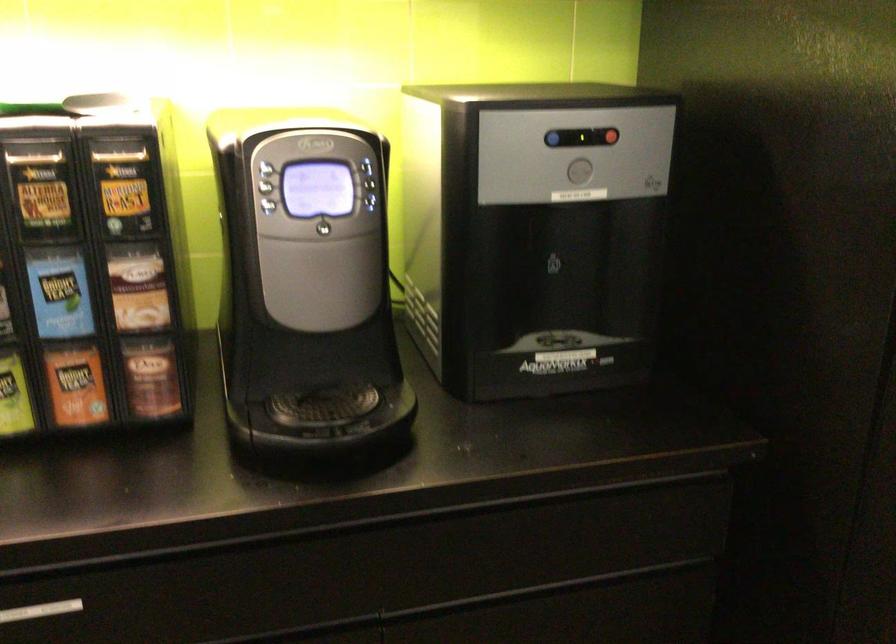
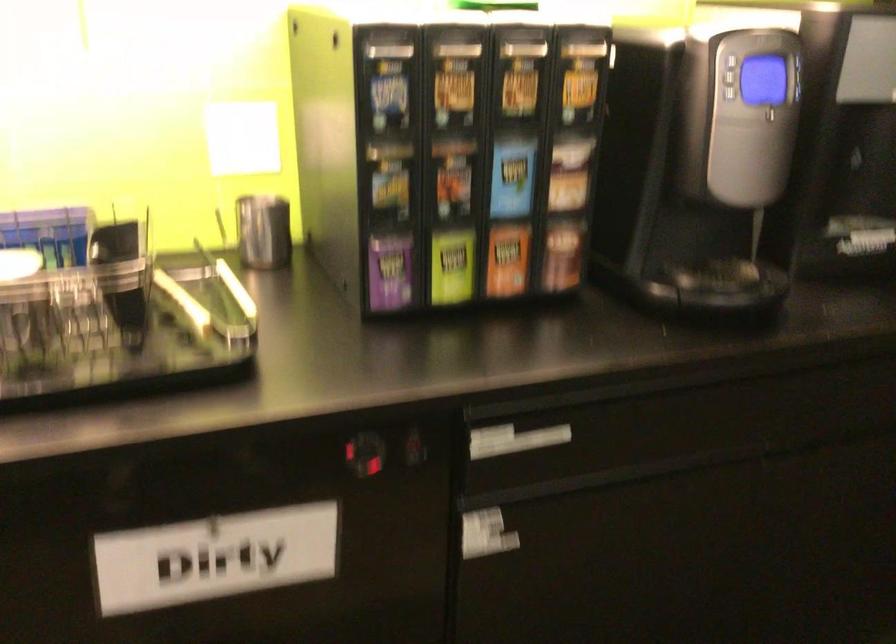
Question: How did the camera likely rotate?

Choices:
 (A) Left
 (B) Right
 (C) Up
 (D) Down

Answer: (B)